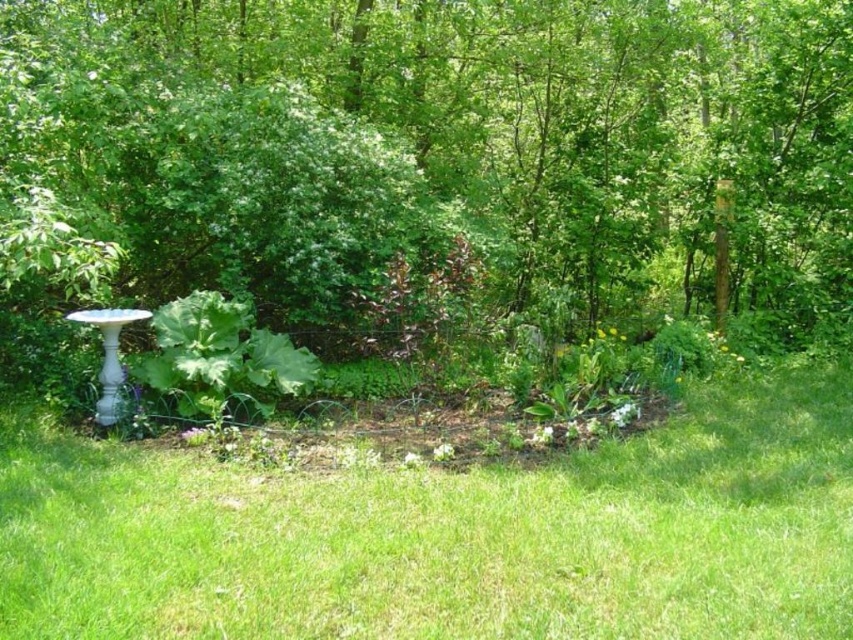
You are standing in the garden described in the scene. You see a point marked at coordinates (x=447, y=144). What object is located at this point?

The point at coordinates (x=447, y=144) corresponds to the green leafy tree at center.

You are a gardener who wants to plant a new flower in the garden. You have a small flower pot that needs to be placed in an area not occupied by the green leafy tree at center or the green grass at lower center. Is there a spot available in the garden bed where you can place the flower pot?

The green leafy tree at center is positioned over green grass at lower center, so there might be space around them in the garden bed where you can place the flower pot.

You are standing in the garden and want to place a small statue between the two points, point (144,224) and point (38,484). Which point should the statue be closer to in order to be in front of both?

The statue should be closer to point (38,484) because point (144,224) is behind point (38,484), so placing it near the front point ensures it is in front of both.